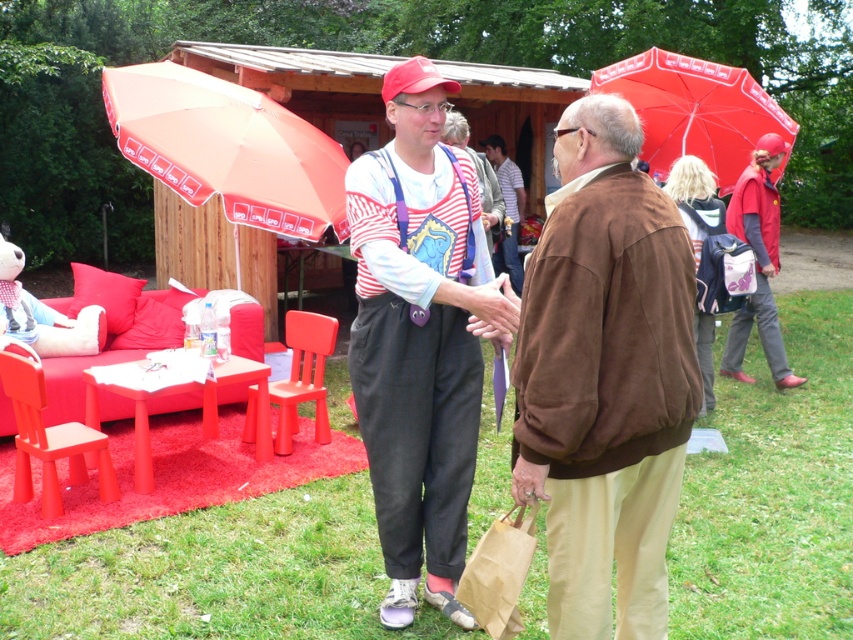
Does red fabric jacket at right appear on the left side of matte white shirt at center?

No, red fabric jacket at right is not to the left of matte white shirt at center.

Does red fabric jacket at right have a greater height compared to matte white shirt at center?

Yes, red fabric jacket at right is taller than matte white shirt at center.

Is point (756, 220) positioned before point (518, 292)?

That is True.

The image size is (853, 640). In order to click on red fabric jacket at right in this screenshot , I will do `click(758, 262)`.

Between point (409, 516) and point (482, 166), which one is positioned behind?

The point (482, 166) is more distant.

Does point (368, 320) come in front of point (453, 128)?

Yes, point (368, 320) is in front of point (453, 128).

What are the coordinates of `matte white t-shirt at center` in the screenshot? It's located at (421, 337).

Does red fabric umbrella at upper right lie in front of striped fabric shirt at center?

No, red fabric umbrella at upper right is behind striped fabric shirt at center.

From the picture: Can you confirm if red fabric umbrella at upper right is positioned to the left of striped fabric shirt at center?

In fact, red fabric umbrella at upper right is to the right of striped fabric shirt at center.

Find the location of a particular element. This screenshot has width=853, height=640. red fabric umbrella at upper right is located at coordinates (695, 112).